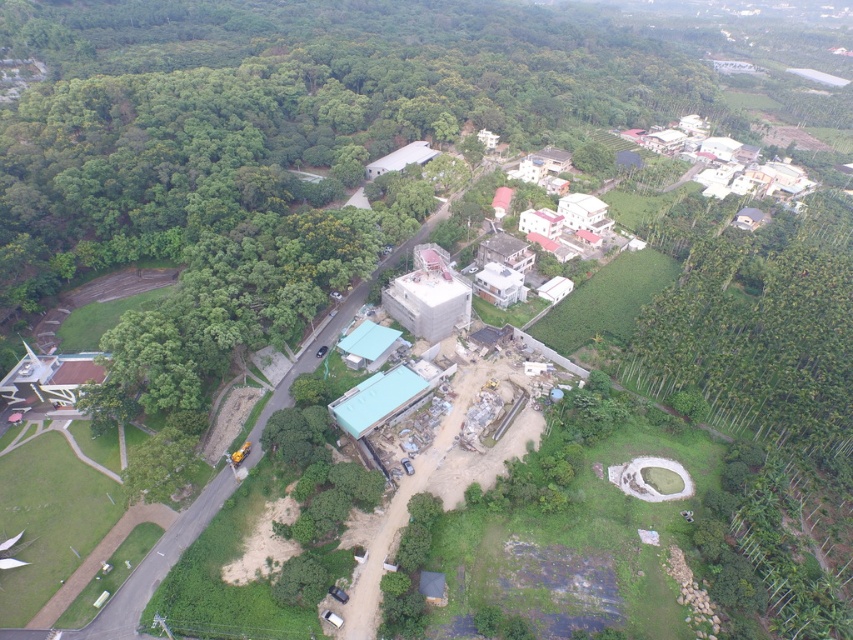
You are a drone operator trying to navigate between two points in an aerial view of a mixed urban and rural landscape. You need to fly from point A to point B. If point A is at point (381, 145) and point B is at point (668, 321), which point is closer to the forested area on the left side?

Point (381, 145) is closer to the forested area on the left side because it is behind point (668, 321), meaning it is situated further towards the left where the dense forested land is located.

You are a drone operator tasked with delivering a package to a specific location marked by point coordinates. The coordinates given are point [276,109]. Based on the scene provided, what type of landmark is located at this coordinate?

The point [276,109] corresponds to a green leafy tree at lower left.